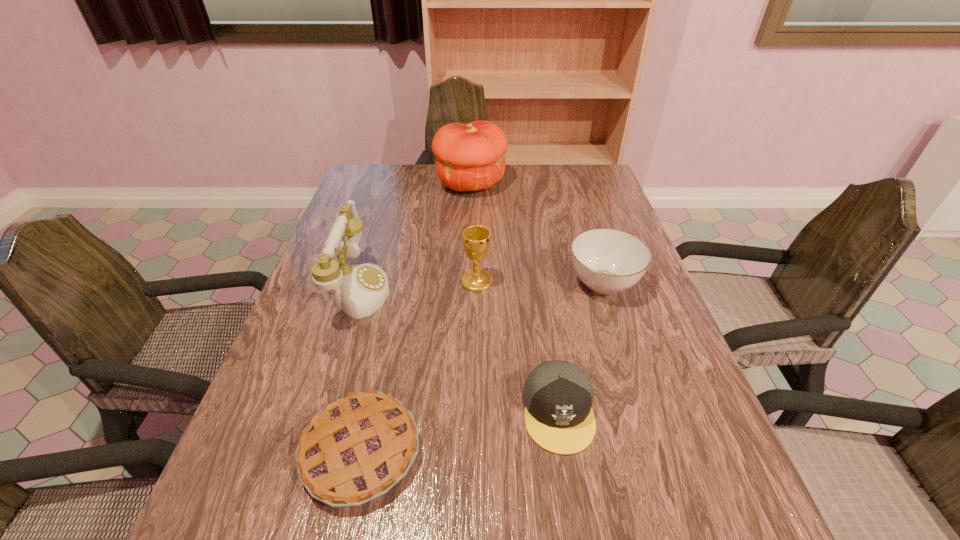
Find the location of a particular element. free space between the third tallest object and the telephone is located at coordinates (418, 285).

Identify the location of vacant space that's between the pie and the fourth shortest object. (419, 367).

The image size is (960, 540). In order to click on free space that is in between the pumpkin and the shortest object in this screenshot , I will do `click(416, 318)`.

Find the location of a particular element. This screenshot has height=540, width=960. vacant space that's between the telephone and the farthest object is located at coordinates (415, 236).

The width and height of the screenshot is (960, 540). Identify the location of vacant area that lies between the shortest object and the telephone. (360, 370).

Locate an element on the screen. The width and height of the screenshot is (960, 540). free space between the cap and the pumpkin is located at coordinates (515, 298).

At what (x,y) coordinates should I click in order to perform the action: click on vacant area that lies between the pie and the telephone. Please return your answer as a coordinate pair (x, y). Looking at the image, I should click on pyautogui.click(x=360, y=370).

You are a GUI agent. You are given a task and a screenshot of the screen. Output one action in this format:
    pyautogui.click(x=<x>, y=<y>)
    Task: Click on the unoccupied position between the shortest object and the chalice
    
    Given the screenshot: What is the action you would take?
    pyautogui.click(x=419, y=367)

Identify which object is the fourth nearest to the pie. Please provide its 2D coordinates. Your answer should be formatted as a tuple, i.e. [(x, y)], where the tuple contains the x and y coordinates of a point satisfying the conditions above.

[(608, 261)]

This screenshot has height=540, width=960. I want to click on the fifth closest object to the fifth tallest object, so click(x=469, y=157).